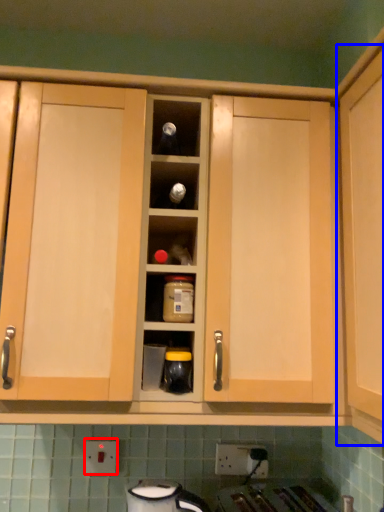
Question: Which object is closer to the camera taking this photo, electric outlet (highlighted by a red box) or cabinetry (highlighted by a blue box)?

Choices:
 (A) electric outlet
 (B) cabinetry

Answer: (B)